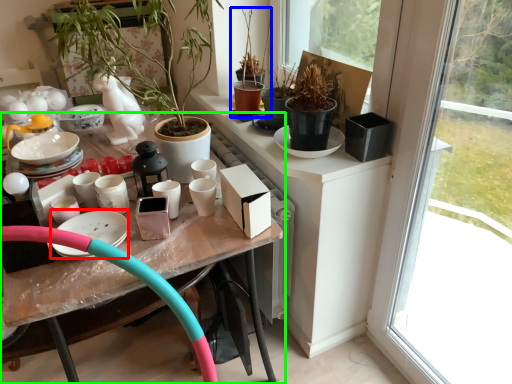
Question: Which object is positioned farthest from tableware (highlighted by a red box)? Select from houseplant (highlighted by a blue box) and table (highlighted by a green box).

Choices:
 (A) houseplant
 (B) table

Answer: (A)